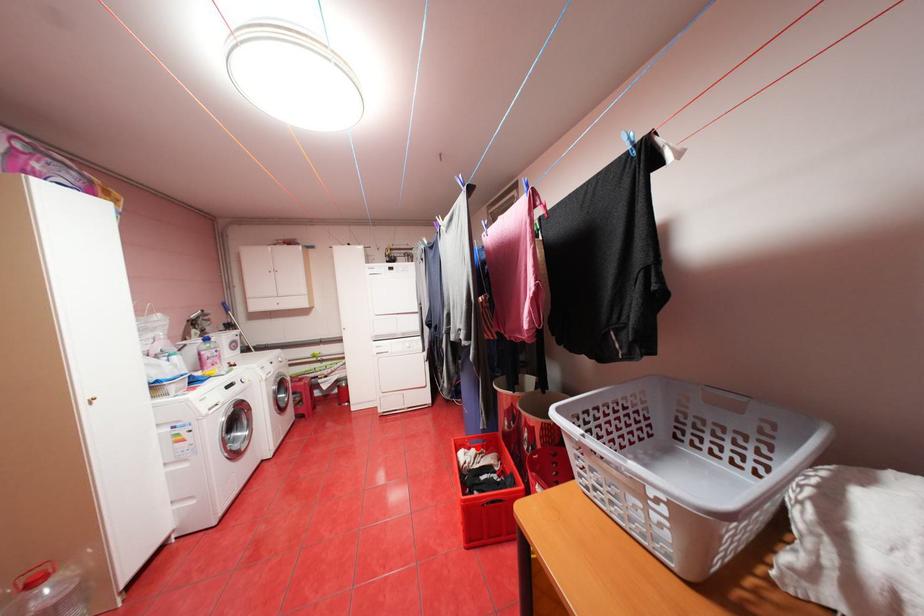
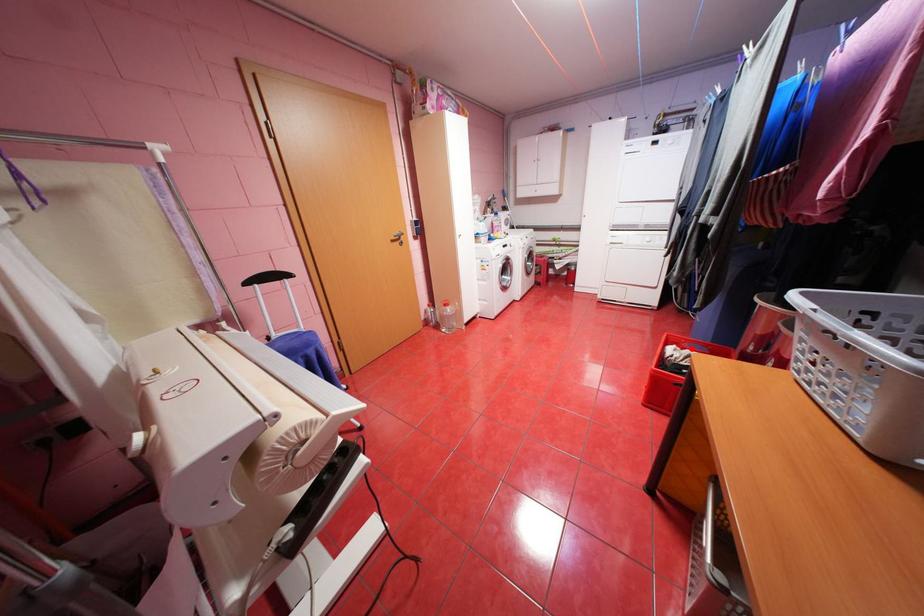
I am providing you with two images of the same scene from different viewpoints. A red point is marked on the first image and another point is marked on the second image. Does the point marked in image1 correspond to the same location as the one in image2?

Yes